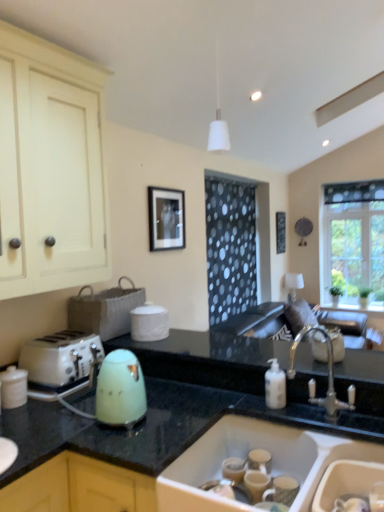
At what (x,y) coordinates should I click in order to perform the action: click on vacant area on top of clear glass window at upper right (from a real-world perspective). Please return your answer as a coordinate pair (x, y). The image size is (384, 512). Looking at the image, I should click on (351, 179).